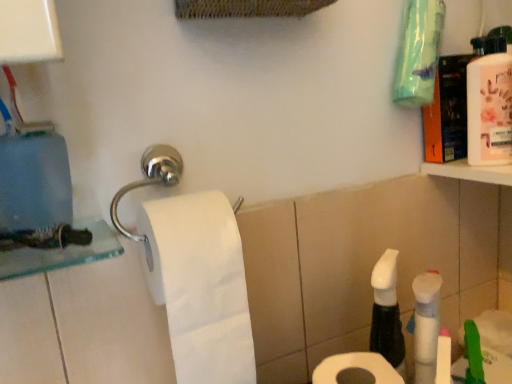
Question: Which direction should I rotate to look at white matte toilet paper at lower center, which is counted as the 2th toilet paper, starting from the left, — up or down?

Choices:
 (A) up
 (B) down

Answer: (B)

Question: Considering the relative sizes of white matte toilet paper at center, the 2th toilet paper in the right-to-left sequence, and white matte toilet paper at lower center, the first toilet paper viewed from the right, in the image provided, is white matte toilet paper at center, the 2th toilet paper in the right-to-left sequence, shorter than white matte toilet paper at lower center, the first toilet paper viewed from the right,?

Choices:
 (A) no
 (B) yes

Answer: (A)

Question: Is white matte toilet paper at center, which is the 1th toilet paper in left-to-right order, smaller than white matte toilet paper at lower center, which is counted as the 2th toilet paper, starting from the left?

Choices:
 (A) yes
 (B) no

Answer: (B)

Question: Is white matte toilet paper at center, the 2th toilet paper in the right-to-left sequence, outside of white matte toilet paper at lower center, which is counted as the 2th toilet paper, starting from the left?

Choices:
 (A) yes
 (B) no

Answer: (A)

Question: Is white matte toilet paper at center, which is the 1th toilet paper in left-to-right order, looking in the opposite direction of white matte toilet paper at lower center, the first toilet paper viewed from the right?

Choices:
 (A) yes
 (B) no

Answer: (B)

Question: From the image's perspective, is white matte toilet paper at center, the 2th toilet paper in the right-to-left sequence, below white matte toilet paper at lower center, the first toilet paper viewed from the right?

Choices:
 (A) yes
 (B) no

Answer: (B)

Question: Does white matte toilet paper at center, the 2th toilet paper in the right-to-left sequence, have a larger size compared to white matte toilet paper at lower center, which is counted as the 2th toilet paper, starting from the left?

Choices:
 (A) yes
 (B) no

Answer: (A)

Question: Is white matte toilet paper at lower center, which is counted as the 2th toilet paper, starting from the left, closer to the viewer compared to white matte toilet paper at center, the 2th toilet paper in the right-to-left sequence?

Choices:
 (A) yes
 (B) no

Answer: (A)

Question: Are white matte toilet paper at lower center, the first toilet paper viewed from the right, and white matte toilet paper at center, which is the 1th toilet paper in left-to-right order, far apart?

Choices:
 (A) yes
 (B) no

Answer: (B)

Question: Considering the relative sizes of white matte toilet paper at lower center, which is counted as the 2th toilet paper, starting from the left, and white matte toilet paper at center, the 2th toilet paper in the right-to-left sequence, in the image provided, is white matte toilet paper at lower center, which is counted as the 2th toilet paper, starting from the left, bigger than white matte toilet paper at center, the 2th toilet paper in the right-to-left sequence,?

Choices:
 (A) no
 (B) yes

Answer: (A)

Question: Considering the relative positions of white matte toilet paper at lower center, the first toilet paper viewed from the right, and white matte toilet paper at center, which is the 1th toilet paper in left-to-right order, in the image provided, is white matte toilet paper at lower center, the first toilet paper viewed from the right, to the right of white matte toilet paper at center, which is the 1th toilet paper in left-to-right order, from the viewer's perspective?

Choices:
 (A) no
 (B) yes

Answer: (B)

Question: Could white matte toilet paper at center, the 2th toilet paper in the right-to-left sequence, be considered to be inside white matte toilet paper at lower center, the first toilet paper viewed from the right?

Choices:
 (A) yes
 (B) no

Answer: (B)

Question: Can we say white matte toilet paper at lower center, which is counted as the 2th toilet paper, starting from the left, lies outside white matte toilet paper at center, which is the 1th toilet paper in left-to-right order?

Choices:
 (A) no
 (B) yes

Answer: (B)

Question: Is white matte toilet paper at center, which is the 1th toilet paper in left-to-right order, at the back of pink glossy mouthwash at upper right?

Choices:
 (A) yes
 (B) no

Answer: (B)